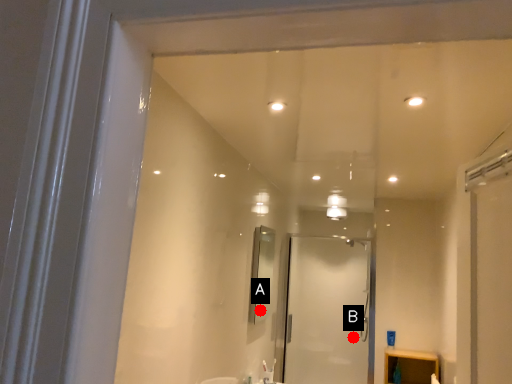
Question: Two points are circled on the image, labeled by A and B beside each circle. Which point is further to the camera?

Choices:
 (A) A is further
 (B) B is further

Answer: (B)